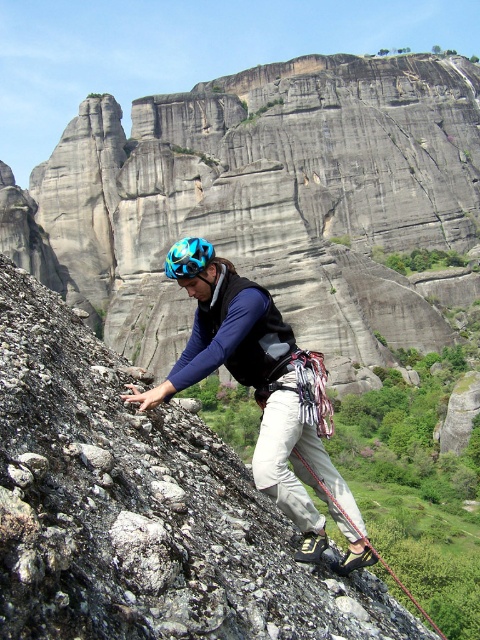
Question: Is the position of matte gray climbing harness at center less distant than that of red nylon rope at center?

Choices:
 (A) yes
 (B) no

Answer: (A)

Question: Which of the following is the farthest from the observer?

Choices:
 (A) (365, 538)
 (B) (172, 253)
 (C) (204, 241)

Answer: (C)

Question: Observing the image, what is the correct spatial positioning of shiny blue helmet at center in reference to red nylon rope at center?

Choices:
 (A) left
 (B) right

Answer: (A)

Question: Which object appears farthest from the camera in this image?

Choices:
 (A) matte gray climbing harness at center
 (B) blue matte helmet at center
 (C) red nylon rope at center

Answer: (B)

Question: Can you confirm if blue matte helmet at center is thinner than red nylon rope at center?

Choices:
 (A) no
 (B) yes

Answer: (A)

Question: Which point is closer to the camera?

Choices:
 (A) red nylon rope at center
 (B) shiny blue helmet at center
 (C) matte gray climbing harness at center
 (D) blue matte helmet at center

Answer: (C)